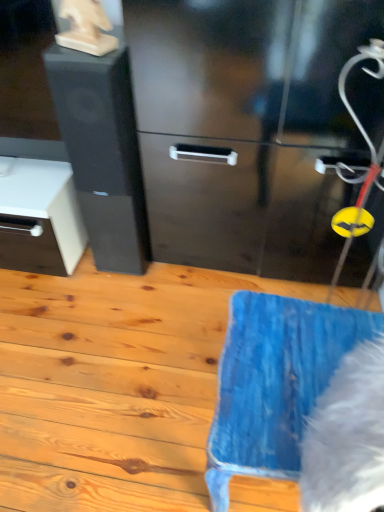
Question: Is blue fabric at lower right next to black matte/file cabinet at left and touching it?

Choices:
 (A) yes
 (B) no

Answer: (B)

Question: From a real-world perspective, is blue fabric at lower right on black matte/file cabinet at left?

Choices:
 (A) no
 (B) yes

Answer: (A)

Question: Is blue fabric at lower right thinner than black matte/file cabinet at left?

Choices:
 (A) yes
 (B) no

Answer: (B)

Question: Would you say blue fabric at lower right is outside black matte/file cabinet at left?

Choices:
 (A) no
 (B) yes

Answer: (B)

Question: From a real-world perspective, is blue fabric at lower right under black matte/file cabinet at left?

Choices:
 (A) no
 (B) yes

Answer: (B)

Question: Is blue fabric at lower right bigger than black matte/file cabinet at left?

Choices:
 (A) yes
 (B) no

Answer: (A)

Question: Does black matte/file cabinet at left have a lesser height compared to blue fabric at lower right?

Choices:
 (A) yes
 (B) no

Answer: (B)

Question: Does black matte/file cabinet at left have a lesser width compared to blue fabric at lower right?

Choices:
 (A) yes
 (B) no

Answer: (A)

Question: Is the depth of black matte/file cabinet at left greater than that of blue fabric at lower right?

Choices:
 (A) yes
 (B) no

Answer: (A)

Question: Is black matte/file cabinet at left positioned before blue fabric at lower right?

Choices:
 (A) no
 (B) yes

Answer: (A)

Question: From the image's perspective, is black matte/file cabinet at left under blue fabric at lower right?

Choices:
 (A) yes
 (B) no

Answer: (B)

Question: Can you confirm if black matte/file cabinet at left is bigger than blue fabric at lower right?

Choices:
 (A) no
 (B) yes

Answer: (A)

Question: Can you confirm if white fluffy animal at lower right is bigger than black matte/file cabinet at left?

Choices:
 (A) no
 (B) yes

Answer: (A)